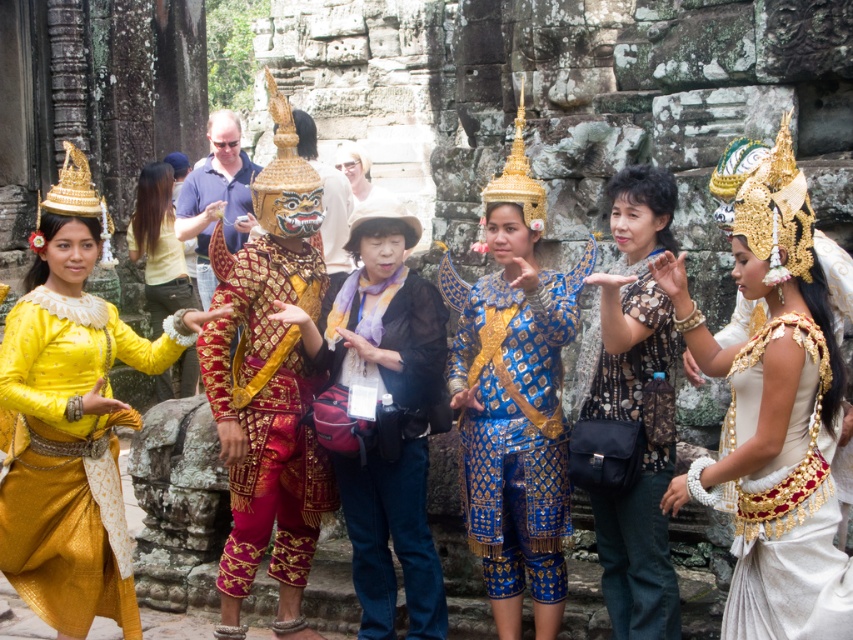
In the scene shown: You are an event planner setting up a stage for a cultural performance. The stage has a backdrop of weathered stone walls with intricate carvings. You need to place two props on the stage floor. One is the white silk headdress at center and the other is the yellow fabric at left. Based on their sizes, which prop should you place first to ensure proper visibility for the audience?

The white silk headdress at center should be placed first because it has a larger size compared to the yellow fabric at left, ensuring it is prominently visible to the audience.

You are a photographer standing at the temple entrance. You want to take a photo that includes both the white silk headdress at center and the yellow fabric at left. The camera you are using has a maximum focus range of 35 meters. Will you be able to capture both objects in the same frame without moving closer?

The distance between the white silk headdress at center and the yellow fabric at left is 38.45 meters. Since the camera can only focus up to 35 meters, you won cannot capture both objects in the same frame without moving closer.

You are a photographer positioned in front of the temple scene. You notice the white silk headdress at center and the yellow fabric at left. Which object is positioned lower in the image?

The white silk headdress at center is positioned below the yellow fabric at left, so it is lower in the image.